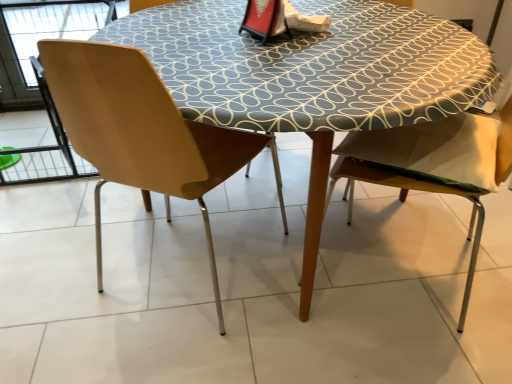
Find the location of a particular element. The width and height of the screenshot is (512, 384). free location to the left of matte wood chair at left, arranged as the 1th chair when viewed from the left is located at coordinates (71, 269).